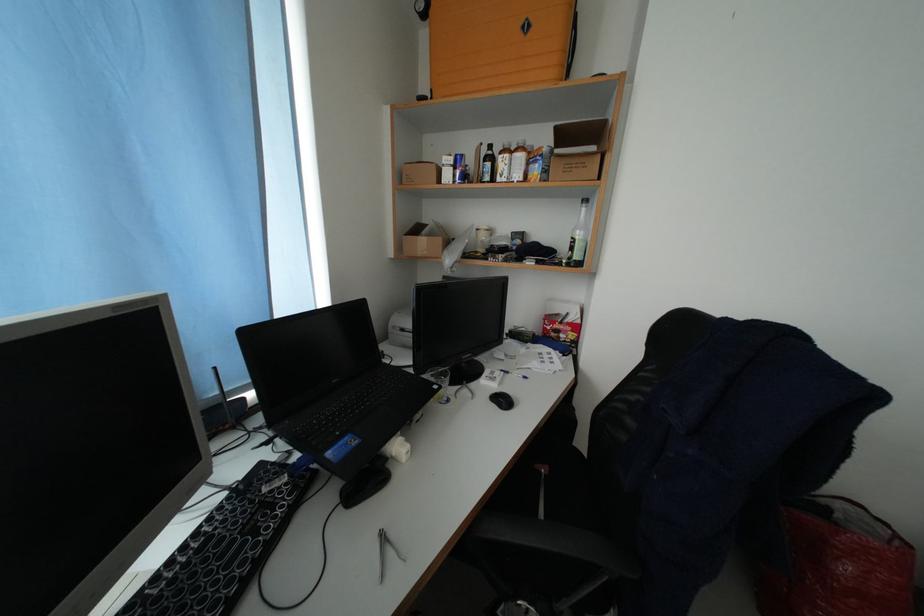
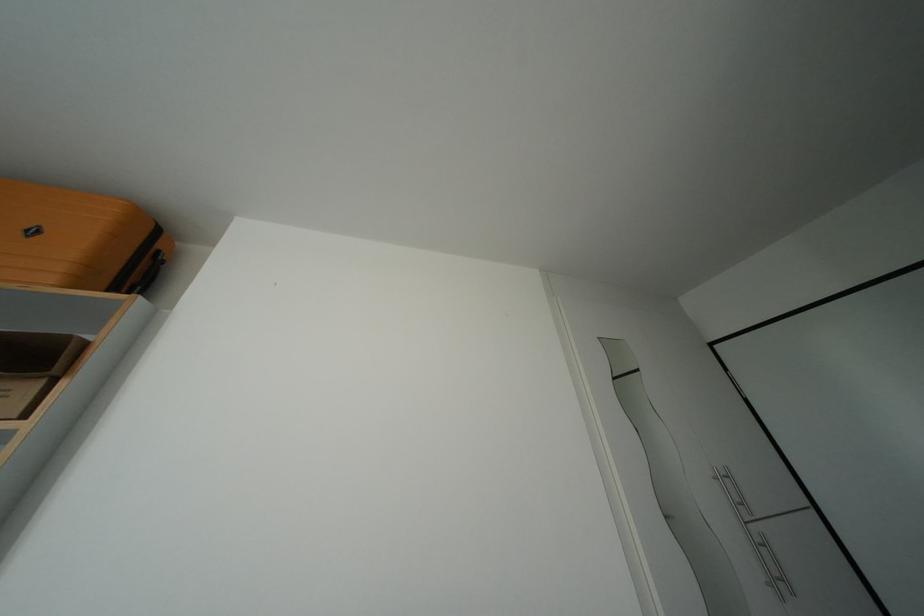
The point at (x=535, y=31) is marked in the first image. Where is the corresponding point in the second image?

(42, 237)